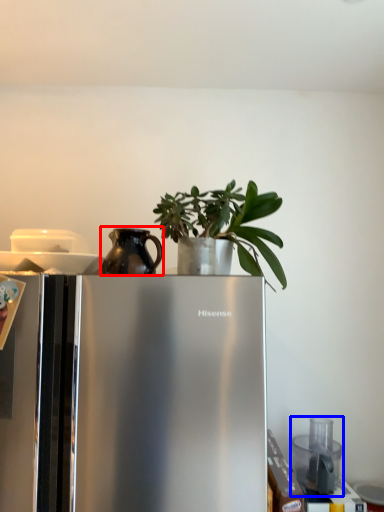
Question: Which point is further to the camera, jug (highlighted by a red box) or appliance (highlighted by a blue box)?

Choices:
 (A) jug
 (B) appliance

Answer: (B)